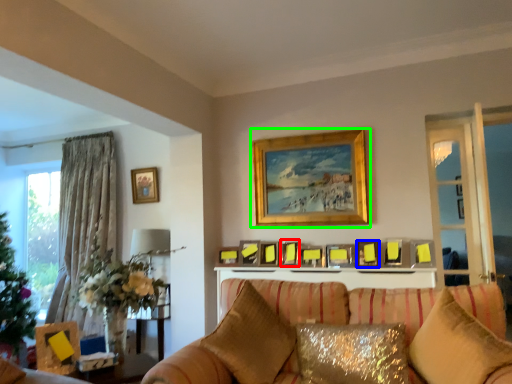
Question: Considering the real-world distances, which object is closest to picture frame (highlighted by a red box)? picture frame (highlighted by a blue box) or picture frame (highlighted by a green box).

Choices:
 (A) picture frame
 (B) picture frame

Answer: (A)